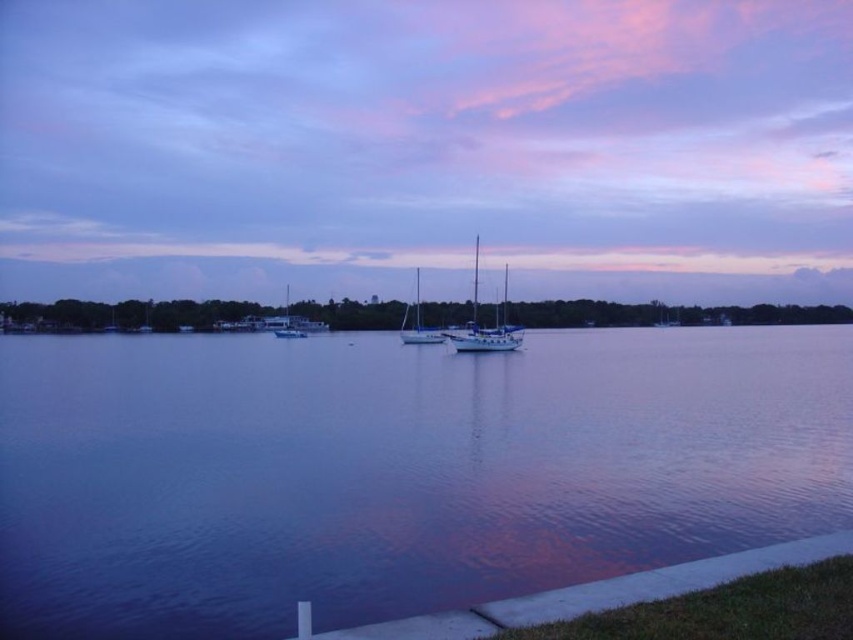
Between point (469, 323) and point (399, 330), which one is positioned in front?

Point (469, 323) is in front.

Which is in front, point (471, 344) or point (409, 339)?

Point (471, 344)

I want to click on white glossy sailboat at center, so (485, 326).

Is smooth water at center wider than white glossy sailboat at center?

Correct, the width of smooth water at center exceeds that of white glossy sailboat at center.

Is smooth water at center below white glossy sailboat at center?

Yes, smooth water at center is below white glossy sailboat at center.

Does point (259, 368) come farther from viewer compared to point (514, 340)?

No.

This screenshot has height=640, width=853. I want to click on smooth water at center, so click(x=395, y=470).

Is smooth water at center further to the viewer compared to white matte sailboat at center?

No.

Between smooth water at center and white matte sailboat at center, which one appears on the right side from the viewer's perspective?

smooth water at center is more to the right.

What do you see at coordinates (395, 470) in the screenshot? The width and height of the screenshot is (853, 640). I see `smooth water at center` at bounding box center [395, 470].

I want to click on smooth water at center, so click(395, 470).